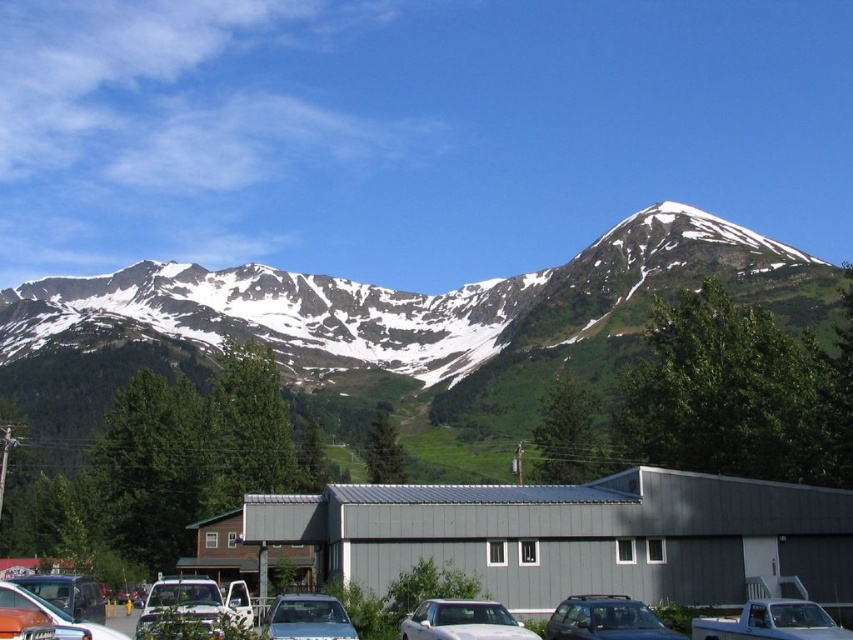
Question: Does metallic silver cars at lower center appear on the left side of metallic blue sedan at center?

Choices:
 (A) yes
 (B) no

Answer: (B)

Question: Which object is positioned farthest from the snowy granite mountain range at upper center?

Choices:
 (A) metallic blue sedan at center
 (B) metallic silver truck at lower left
 (C) white glossy sedan at center

Answer: (B)

Question: Is snowy granite mountain range at upper center bigger than white matte truck at lower right?

Choices:
 (A) yes
 (B) no

Answer: (A)

Question: Can you confirm if white matte truck at lower right is thinner than metallic blue sedan at center?

Choices:
 (A) yes
 (B) no

Answer: (B)

Question: Which object appears farthest from the camera in this image?

Choices:
 (A) white glossy sedan at center
 (B) snowy granite mountain range at upper center
 (C) white matte truck at lower left
 (D) metallic silver cars at lower center

Answer: (B)

Question: Among these objects, which one is nearest to the camera?

Choices:
 (A) metallic silver truck at lower left
 (B) metallic silver cars at lower center
 (C) white matte truck at lower left
 (D) white matte truck at lower right

Answer: (A)